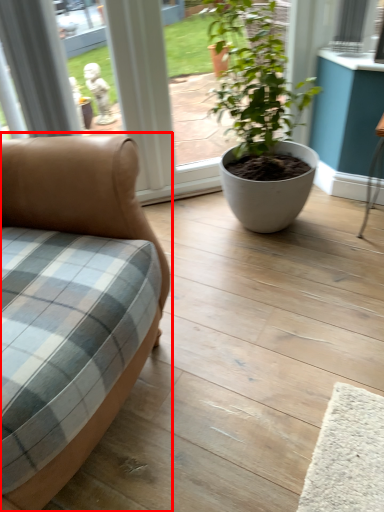
Question: Observing the image, what is the correct spatial positioning of studio couch (annotated by the red box) in reference to houseplant?

Choices:
 (A) right
 (B) left

Answer: (B)